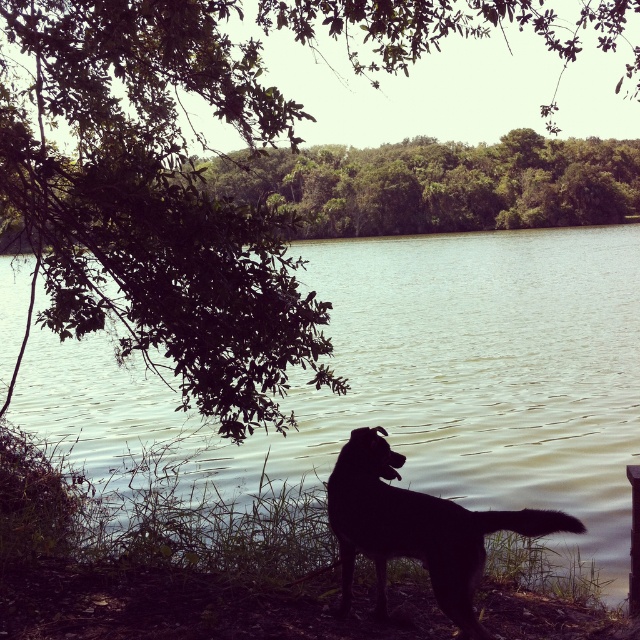
Who is higher up, smooth water at center or green leafy tree at upper left?

green leafy tree at upper left is higher up.

Which is in front, point (496, 253) or point (141, 289)?

Point (141, 289) is in front.

At what (x,y) coordinates should I click in order to perform the action: click on smooth water at center. Please return your answer as a coordinate pair (x, y). This screenshot has height=640, width=640. Looking at the image, I should click on (416, 380).

Describe the element at coordinates (156, 196) in the screenshot. I see `green leafy tree at upper left` at that location.

Locate an element on the screen. The height and width of the screenshot is (640, 640). green leafy tree at upper left is located at coordinates (156, 196).

Does smooth water at center lie in front of black fur dog at lower center?

That is False.

How much distance is there between smooth water at center and black fur dog at lower center?

9.79 meters

Which is in front, point (605, 264) or point (326, 484)?

Point (326, 484) is in front.

In order to click on smooth water at center in this screenshot , I will do `click(416, 380)`.